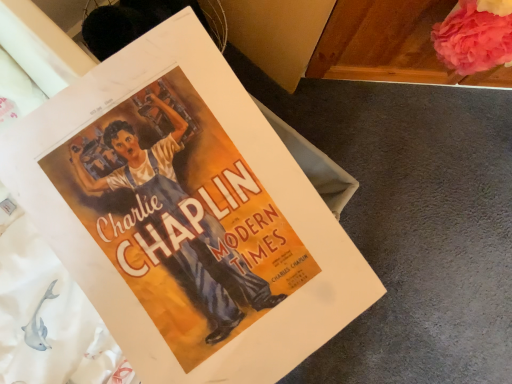
Where is `vacant point above matte paper poster at center (from a real-world perspective)`? The width and height of the screenshot is (512, 384). vacant point above matte paper poster at center (from a real-world perspective) is located at coordinates (156, 163).